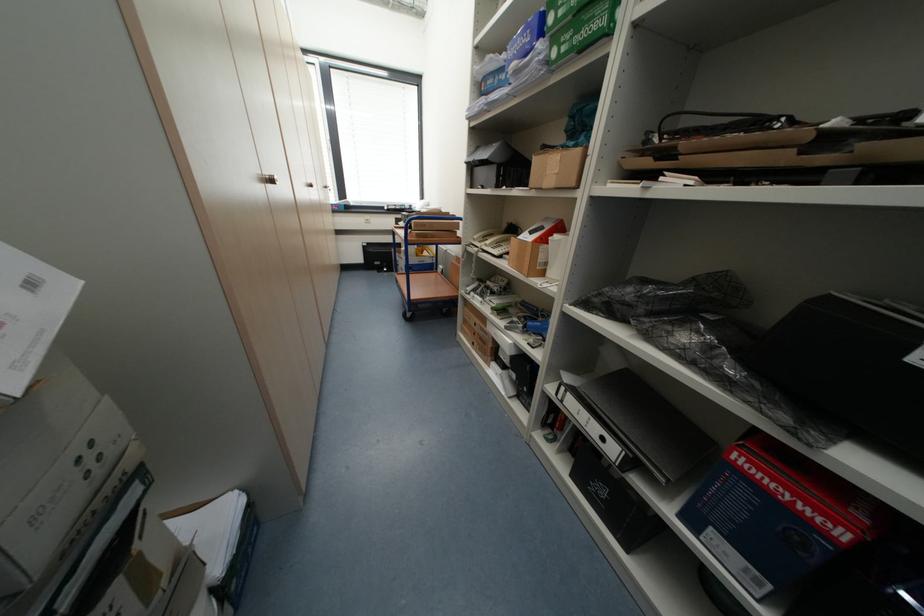
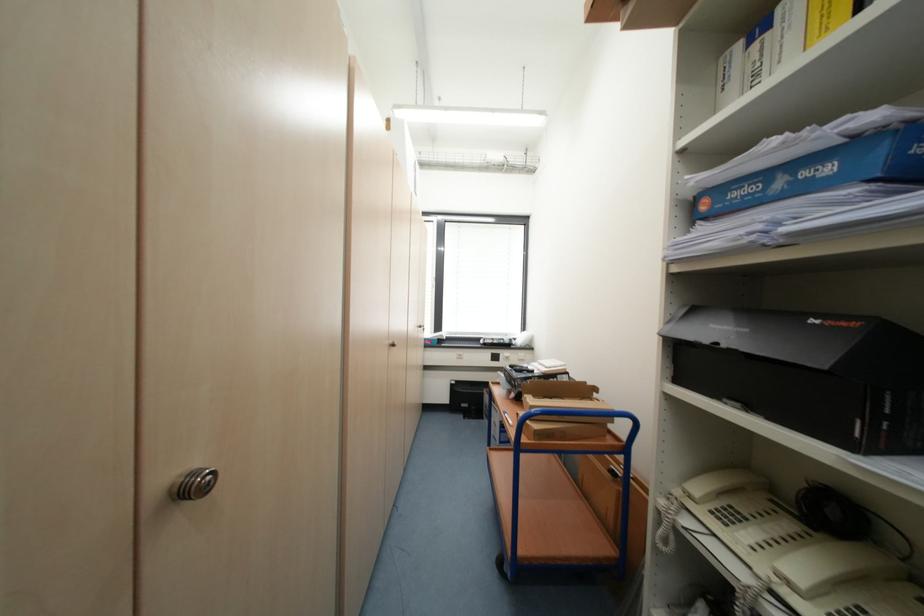
Question: I am providing you with two images of the same scene from different viewpoints. Please identify which objects are invisible in image2.

Choices:
 (A) brown cardboard box
 (B) silver cabinet knob
 (C) black cardboard box
 (D) none of these

Answer: (D)